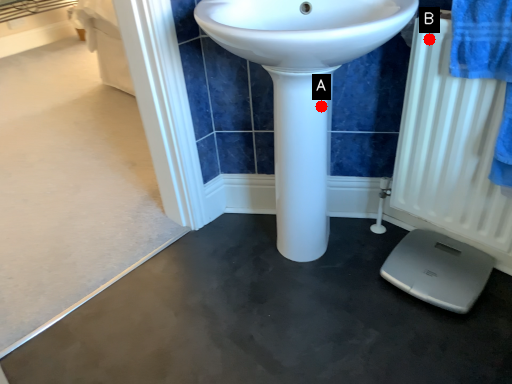
Question: Two points are circled on the image, labeled by A and B beside each circle. Which point is farther from the camera taking this photo?

Choices:
 (A) A is further
 (B) B is further

Answer: (A)